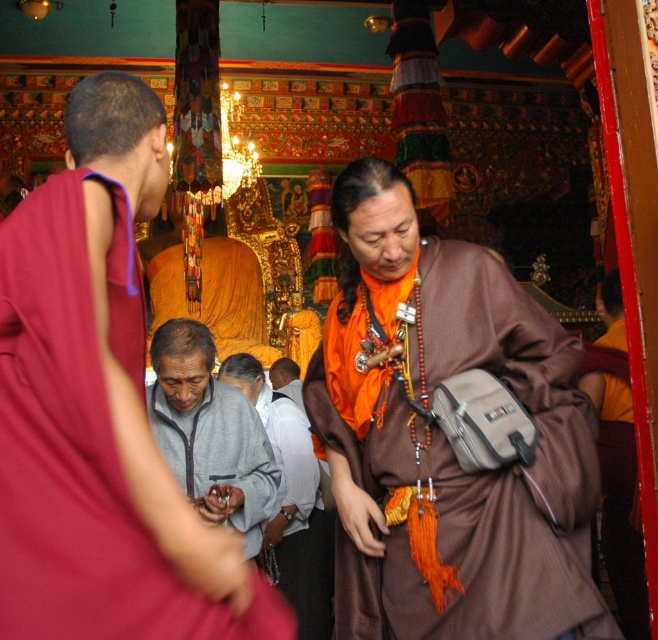
In the temple scene, there are two people wearing the matte red robe at center and the gray fleece jacket at center. From the observer standing in front of them, which one is positioned to the right?

The matte red robe at center is to the right of the gray fleece jacket at center.

You are a visitor standing in the temple and want to take a photo of both the matte red robe at center and the gray fleece jacket at center in the same frame. Based on their distance, will you need to zoom in or zoom out to include both in your shot?

The matte red robe at center and gray fleece jacket at center are 12.72 meters apart from each other. To include both in the same frame, you would need to zoom out to capture the wider angle required for the distance between them.